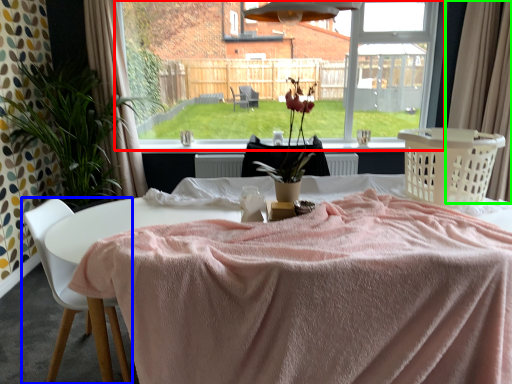
Question: Which object is positioned farthest from window (highlighted by a red box)? Select from chair (highlighted by a blue box) and curtain (highlighted by a green box).

Choices:
 (A) chair
 (B) curtain

Answer: (A)